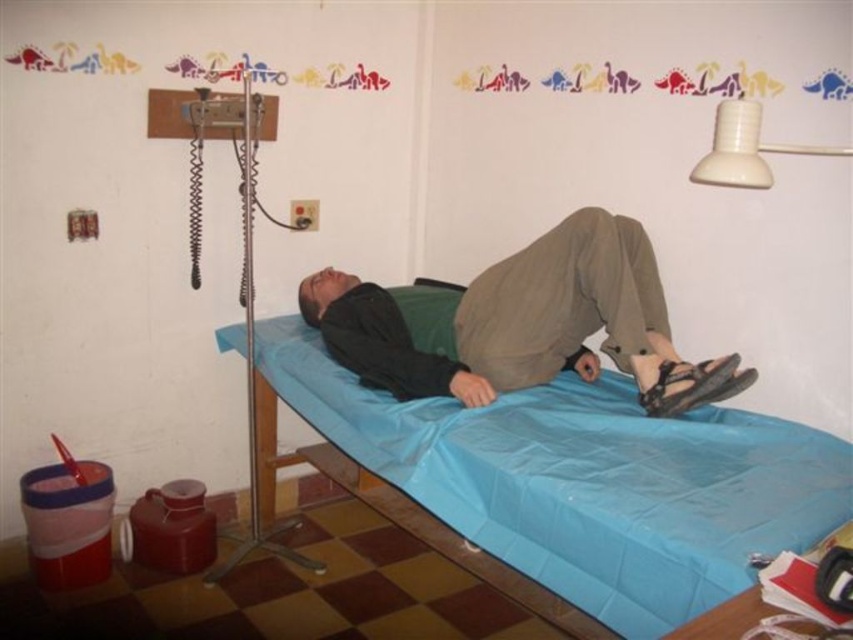
Describe the element at coordinates (583, 481) in the screenshot. I see `blue fabric mattress at center` at that location.

Based on the photo, is blue fabric mattress at center above white plastic lamp at upper right?

No, blue fabric mattress at center is not above white plastic lamp at upper right.

I want to click on blue fabric mattress at center, so click(x=583, y=481).

Locate an element on the screen. The image size is (853, 640). blue fabric mattress at center is located at coordinates (583, 481).

Can you confirm if blue fabric mattress at center is positioned to the right of brown matte pants at center?

No, blue fabric mattress at center is not to the right of brown matte pants at center.

Which is above, blue fabric mattress at center or brown matte pants at center?

brown matte pants at center is higher up.

Is point (708, 563) farther from camera compared to point (651, 259)?

That is False.

The width and height of the screenshot is (853, 640). Identify the location of blue fabric mattress at center. (583, 481).

Can you confirm if brown matte pants at center is positioned to the left of white plastic lamp at upper right?

Yes, brown matte pants at center is to the left of white plastic lamp at upper right.

Between brown matte pants at center and white plastic lamp at upper right, which one appears on the left side from the viewer's perspective?

brown matte pants at center

At what (x,y) coordinates should I click in order to perform the action: click on brown matte pants at center. Please return your answer as a coordinate pair (x, y). The width and height of the screenshot is (853, 640). Looking at the image, I should click on coord(521,323).